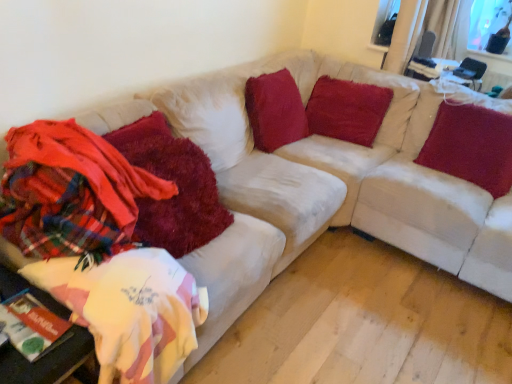
Question: From a real-world perspective, is shaggy red blanket at left, positioned as the 1th blanket in right-to-left order, above or below velvet red pillow at upper right, which is counted as the third pillow, starting from the left?

Choices:
 (A) below
 (B) above

Answer: (A)

Question: Which is correct: shaggy red blanket at left, positioned as the 1th blanket in right-to-left order, is inside velvet red pillow at upper right, which is the first pillow from right to left, or outside of it?

Choices:
 (A) outside
 (B) inside

Answer: (A)

Question: Which is farther from the velvet red pillow at upper right, which is the first pillow from right to left?

Choices:
 (A) transparent glass window screen at upper right, placed as the 1th window screen when sorted from left to right
 (B) transparent glass window at upper right, the first window screen viewed from the right
 (C) plaid fabric blanket at left, which is counted as the second blanket, starting from the right
 (D) white fabric table at lower left
 (E) velvety red pillow at upper center, the third pillow positioned from the right

Answer: (D)

Question: Estimate the real-world distances between objects in this image. Which object is closer to the velvety red pillow at upper center, the second pillow viewed from the left?

Choices:
 (A) velvety red pillow at upper center, arranged as the first pillow when viewed from the left
 (B) transparent glass window at upper right, the second window screen positioned from the left
 (C) plaid fabric blanket at left, acting as the first blanket starting from the left
 (D) shaggy red blanket at left, the 2th blanket from the left
 (E) velvet red pillow at upper right, which is counted as the third pillow, starting from the left

Answer: (A)